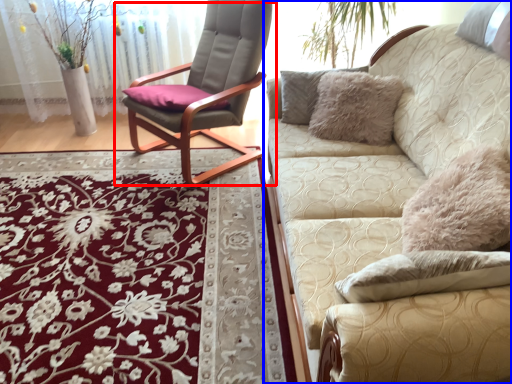
Question: Among these objects, which one is nearest to the camera, chair (highlighted by a red box) or studio couch (highlighted by a blue box)?

Choices:
 (A) chair
 (B) studio couch

Answer: (B)